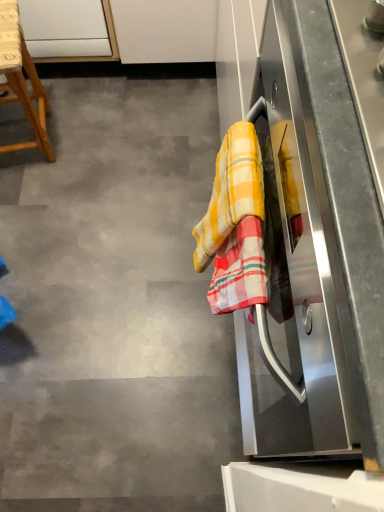
I want to click on free point above yellow checkered towel at right (from a real-world perspective), so click(x=104, y=244).